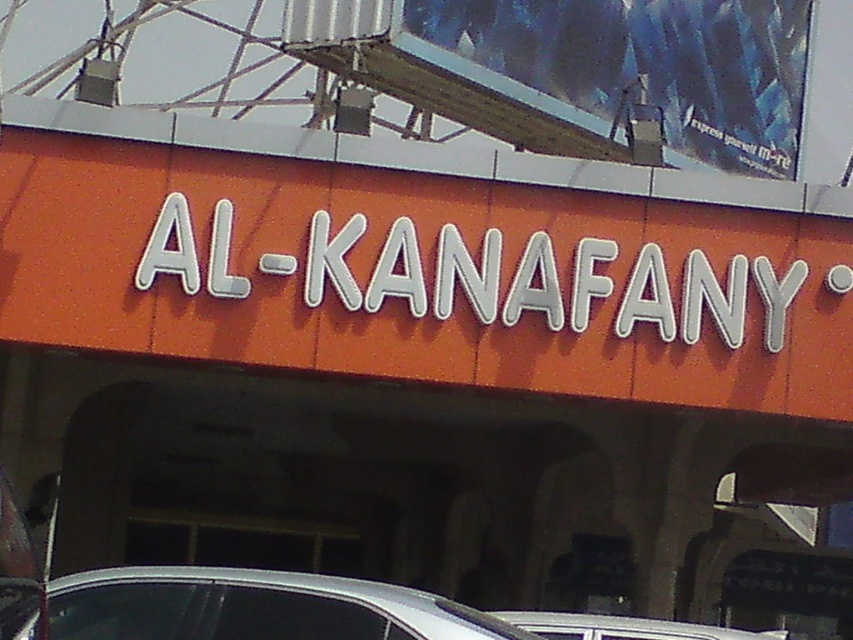
Question: Considering the real-world distances, which object is closest to the metallic blue billboard at upper right?

Choices:
 (A) silver metallic car at lower center
 (B) white plastic car at center
 (C) orange matte sign at center

Answer: (C)

Question: Which of the following is the farthest from the observer?

Choices:
 (A) white plastic car at center
 (B) orange matte sign at center

Answer: (B)

Question: Estimate the real-world distances between objects in this image. Which object is closer to the silver metallic car at lower center?

Choices:
 (A) metallic blue billboard at upper right
 (B) orange matte sign at center
 (C) white plastic car at center

Answer: (C)

Question: Is orange matte sign at center bigger than silver metallic car at lower center?

Choices:
 (A) yes
 (B) no

Answer: (A)

Question: Is the position of orange matte sign at center more distant than that of silver metallic car at lower center?

Choices:
 (A) yes
 (B) no

Answer: (A)

Question: Can you confirm if orange matte sign at center is positioned to the right of silver metallic car at lower center?

Choices:
 (A) no
 (B) yes

Answer: (B)